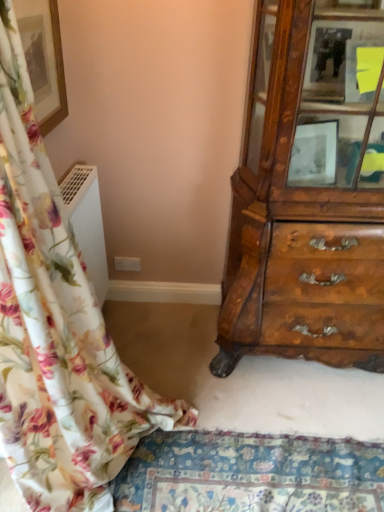
Question: Based on their sizes in the image, would you say matte gold picture frame at upper left is bigger or smaller than floral fabric curtain at left?

Choices:
 (A) small
 (B) big

Answer: (A)

Question: Relative to floral fabric curtain at left, is matte gold picture frame at upper left in front or behind?

Choices:
 (A) front
 (B) behind

Answer: (B)

Question: Considering the real-world distances, which object is closest to the matte gold picture frame at upper left?

Choices:
 (A) wooden cabinet at right
 (B) floral fabric mat at lower center
 (C) floral fabric curtain at left

Answer: (C)

Question: Considering the real-world distances, which object is closest to the matte gold picture frame at upper left?

Choices:
 (A) floral fabric mat at lower center
 (B) wooden cabinet at right
 (C) floral fabric curtain at left

Answer: (C)